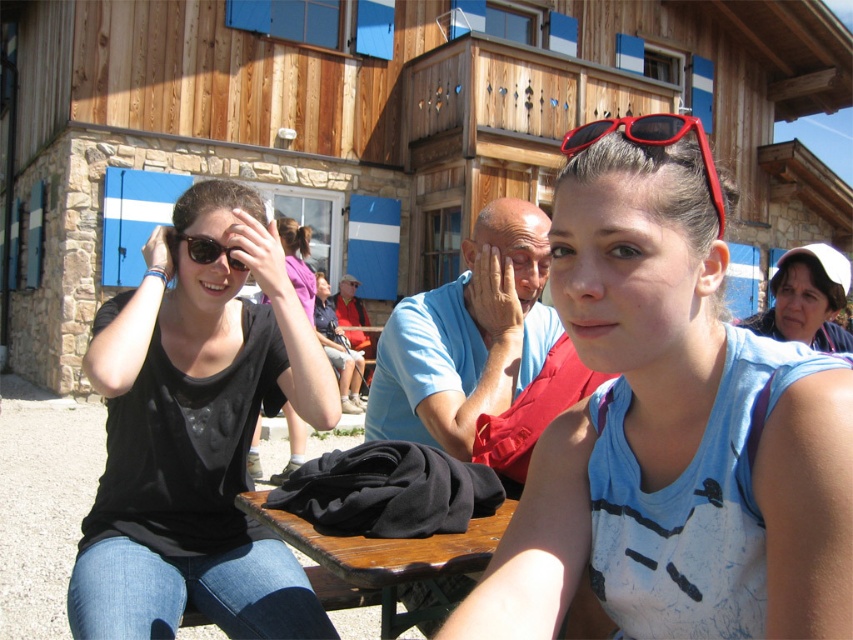
You are standing at the picnic table and want to place a small snack between the matte white hat at upper right and the matte black sunglasses at upper left. Based on their positions, which object is closer to the edge of the table where you are standing?

The matte white hat at upper right is positioned under the matte black sunglasses at upper left, so the matte white hat at upper right is closer to the edge of the table where you are standing.

Based on the photo, you are standing at the picnic table and want to take a photo of the point at coordinates point (238, 602). If your camera has a focal length of 50mm and you want to capture the entire scene within a 60 degree field of view, will you be able to include the point in your photo?

The point (238, 602) is 2.25 meters away from the viewer. Using the camera specifications, the field of view at 50mm focal length covers approximately 46.8 degrees horizontally. To determine if the point is within the frame, calculate the maximum distance the camera can capture at that focal length. However, without knowing the sensor size or the exact dimensions of the scene, it is impossible to definitively confirm if the point will be included. Additional information about the sensor size or the width